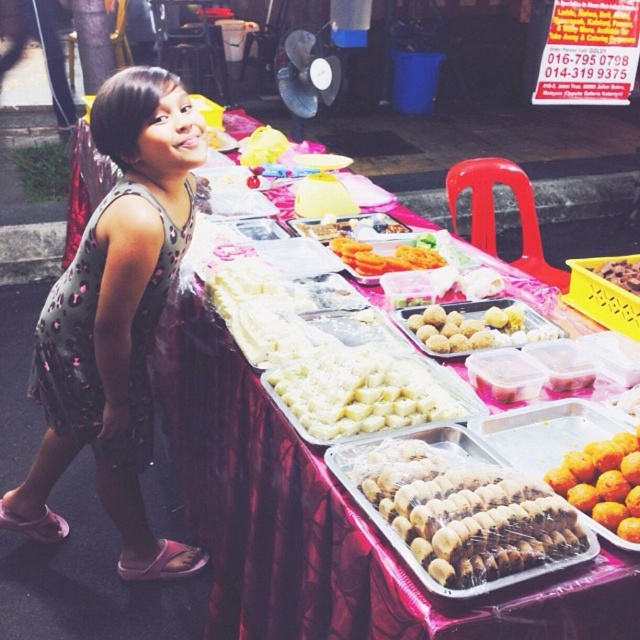
Is pink dotted dress at left smaller than brown matte cookies at center?

No.

This screenshot has height=640, width=640. In order to click on pink dotted dress at left in this screenshot , I will do `click(116, 320)`.

Which is behind, point (604, 451) or point (376, 262)?

The point (376, 262) is behind.

Can you confirm if orange matte/orange matte/orange matte/orange matte/orange matte/orange matte/orange matte/orange matte/orange matte/orange matte/orange matte/orange matte/orange matte/orange matte/orange matte/orange matte/orange matte/orange matte/orange matte/orange matte/orange matte/orange matte/orange matte/orange matte/orange matte/orange matte/orange matte/orange matte/orange matte/orange matte/orange matte/orange matte/orange matte/orange matte/orange matte/orange matte/orange matte/orange matte/orange matte/orange matte/orange matte/orange matte/orange matte is taller than orange matte carrot at center?

Yes.

Is point (602, 504) positioned before point (436, 257)?

Yes, it is.

Where is `orange matte/orange matte/orange matte/orange matte/orange matte/orange matte/orange matte/orange matte/orange matte/orange matte/orange matte/orange matte/orange matte/orange matte/orange matte/orange matte/orange matte/orange matte/orange matte/orange matte/orange matte/orange matte/orange matte/orange matte/orange matte/orange matte/orange matte/orange matte/orange matte/orange matte/orange matte/orange matte/orange matte/orange matte/orange matte/orange matte/orange matte/orange matte/orange matte/orange matte/orange matte/orange matte/orange matte`? This screenshot has width=640, height=640. orange matte/orange matte/orange matte/orange matte/orange matte/orange matte/orange matte/orange matte/orange matte/orange matte/orange matte/orange matte/orange matte/orange matte/orange matte/orange matte/orange matte/orange matte/orange matte/orange matte/orange matte/orange matte/orange matte/orange matte/orange matte/orange matte/orange matte/orange matte/orange matte/orange matte/orange matte/orange matte/orange matte/orange matte/orange matte/orange matte/orange matte/orange matte/orange matte/orange matte/orange matte/orange matte/orange matte is located at coordinates (604, 483).

Does pink dotted dress at left have a greater width compared to golden brown doughnut at center?

Yes, pink dotted dress at left is wider than golden brown doughnut at center.

Is point (116, 493) positioned after point (433, 324)?

That is True.

Locate an element on the screen. Image resolution: width=640 pixels, height=640 pixels. pink dotted dress at left is located at coordinates (116, 320).